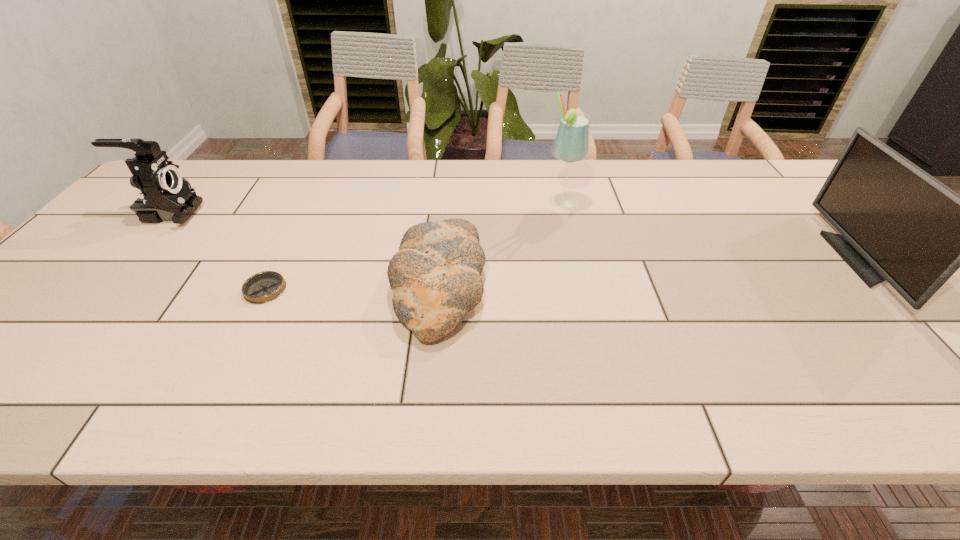
The image size is (960, 540). I want to click on free space in the image that satisfies the following two spatial constraints: 1. on the screen side of the monitor; 2. on the front side of the second shortest object, so click(x=884, y=286).

You are a GUI agent. You are given a task and a screenshot of the screen. Output one action in this format:
    pyautogui.click(x=<x>, y=<y>)
    Task: Click on the vacant space that satisfies the following two spatial constraints: 1. on the lens mount of the bread; 2. on the right side of the camcorder
    The width and height of the screenshot is (960, 540).
    Given the screenshot: What is the action you would take?
    pyautogui.click(x=103, y=286)